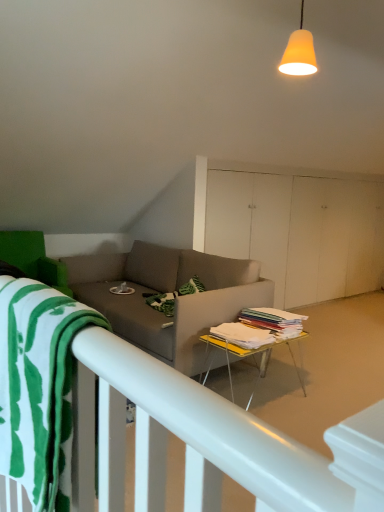
Question: From a real-world perspective, is orange matte lampshade at upper center positioned above or below yellow plastic table at center?

Choices:
 (A) above
 (B) below

Answer: (A)

Question: Visually, is orange matte lampshade at upper center positioned to the left or to the right of yellow plastic table at center?

Choices:
 (A) left
 (B) right

Answer: (B)

Question: Which object is the farthest from the green cotton beach towel at lower left?

Choices:
 (A) orange matte lampshade at upper center
 (B) white matte bed frame at lower left
 (C) yellow plastic table at center

Answer: (A)

Question: Which object is positioned farthest from the white matte bed frame at lower left?

Choices:
 (A) yellow plastic table at center
 (B) green cotton beach towel at lower left
 (C) orange matte lampshade at upper center

Answer: (C)